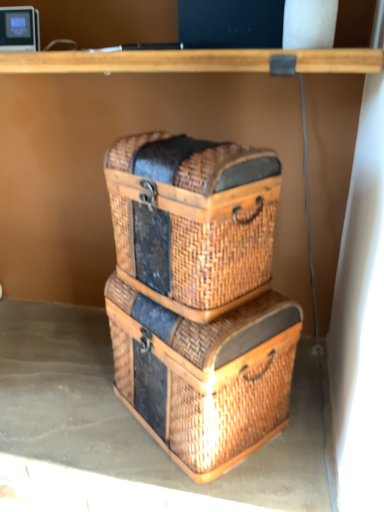
Where is `free space above woven brown basket at center (from a real-world perspective)`? The image size is (384, 512). free space above woven brown basket at center (from a real-world perspective) is located at coordinates (63, 378).